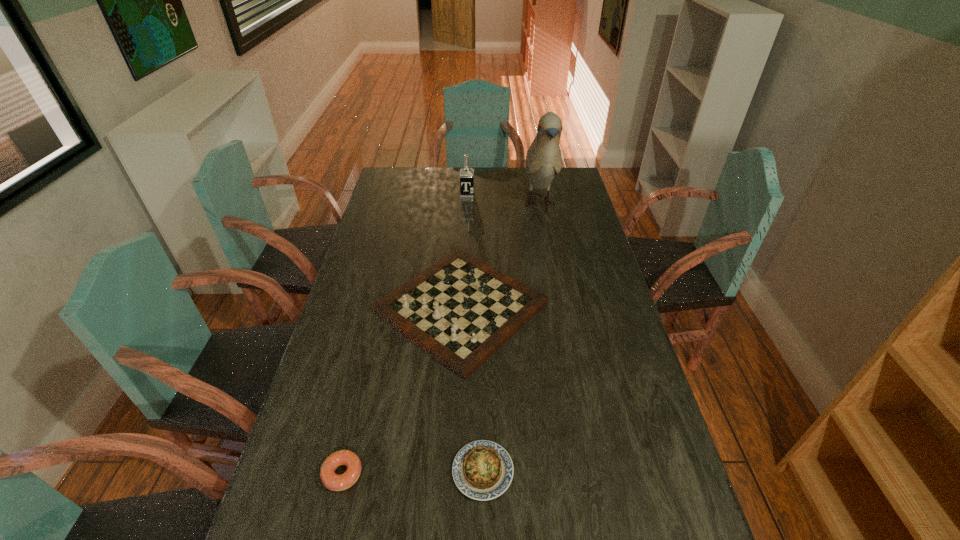
Locate an element on the screen. the tallest object is located at coordinates (543, 160).

This screenshot has width=960, height=540. Identify the location of the fourth shortest object. (466, 174).

Locate an element on the screen. chessboard is located at coordinates (460, 310).

You are a GUI agent. You are given a task and a screenshot of the screen. Output one action in this format:
    pyautogui.click(x=<x>, y=<y>)
    Task: Click on the third farthest object
    The image size is (960, 540).
    Given the screenshot: What is the action you would take?
    pyautogui.click(x=460, y=310)

At what (x,y) coordinates should I click in order to perform the action: click on the second shortest object. Please return your answer as a coordinate pair (x, y). This screenshot has height=540, width=960. Looking at the image, I should click on (331, 480).

You are a GUI agent. You are given a task and a screenshot of the screen. Output one action in this format:
    pyautogui.click(x=<x>, y=<y>)
    Task: Click on the quiche
    Image resolution: width=960 pixels, height=540 pixels.
    Given the screenshot: What is the action you would take?
    pyautogui.click(x=482, y=470)

Where is `vacant position located on the face of the parakeet`? The width and height of the screenshot is (960, 540). vacant position located on the face of the parakeet is located at coordinates (x=555, y=286).

What are the coordinates of `vacant region located 0.210m on the front label of the vodka` in the screenshot? It's located at pos(466,226).

Where is `free space located on the front of the chessboard`? free space located on the front of the chessboard is located at coordinates (454, 465).

Find the location of a particular element. Image resolution: width=960 pixels, height=540 pixels. vacant space located on the back of the doughnut is located at coordinates (363, 388).